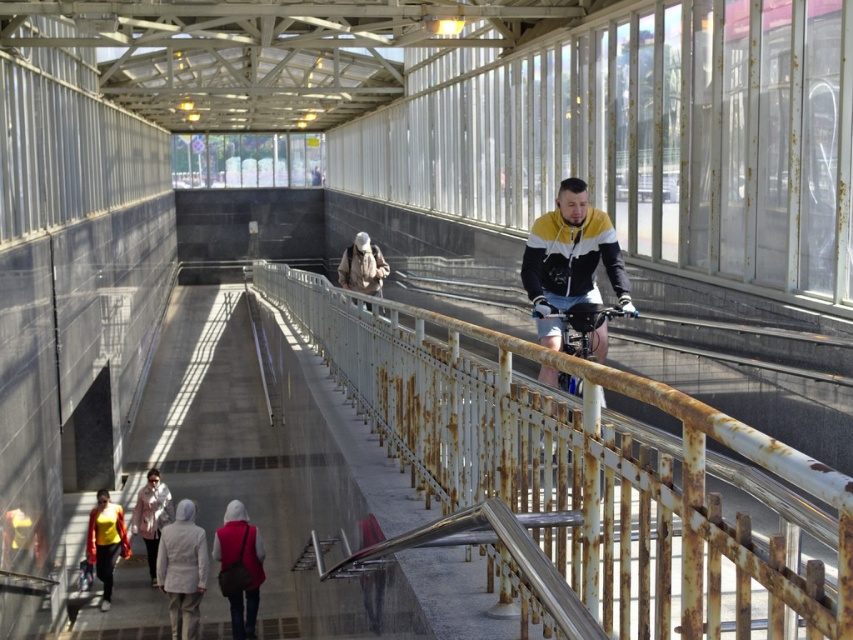
Does point (575, 586) lie in front of point (245, 593)?

Yes, it is in front of point (245, 593).

Based on the photo, does rusty metal railing at center appear over matte red jacket at lower center?

Correct, rusty metal railing at center is located above matte red jacket at lower center.

What do you see at coordinates (589, 472) in the screenshot? The height and width of the screenshot is (640, 853). I see `rusty metal railing at center` at bounding box center [589, 472].

This screenshot has width=853, height=640. I want to click on rusty metal railing at center, so click(x=589, y=472).

Who is higher up, yellow-black jacket at center or light gray fabric jacket at lower center?

yellow-black jacket at center

Which is more to the left, yellow-black jacket at center or light gray fabric jacket at lower center?

From the viewer's perspective, light gray fabric jacket at lower center appears more on the left side.

Which is behind, point (526, 259) or point (189, 621)?

Point (189, 621)

Identify the location of yellow-black jacket at center. (570, 259).

How distant is yellow fabric jacket at lower left from white matte jacket at lower left?

yellow fabric jacket at lower left is 22.86 inches from white matte jacket at lower left.

Who is lower down, yellow fabric jacket at lower left or white matte jacket at lower left?

yellow fabric jacket at lower left is lower down.

Find the location of a particular element. This screenshot has width=853, height=640. yellow fabric jacket at lower left is located at coordinates (105, 541).